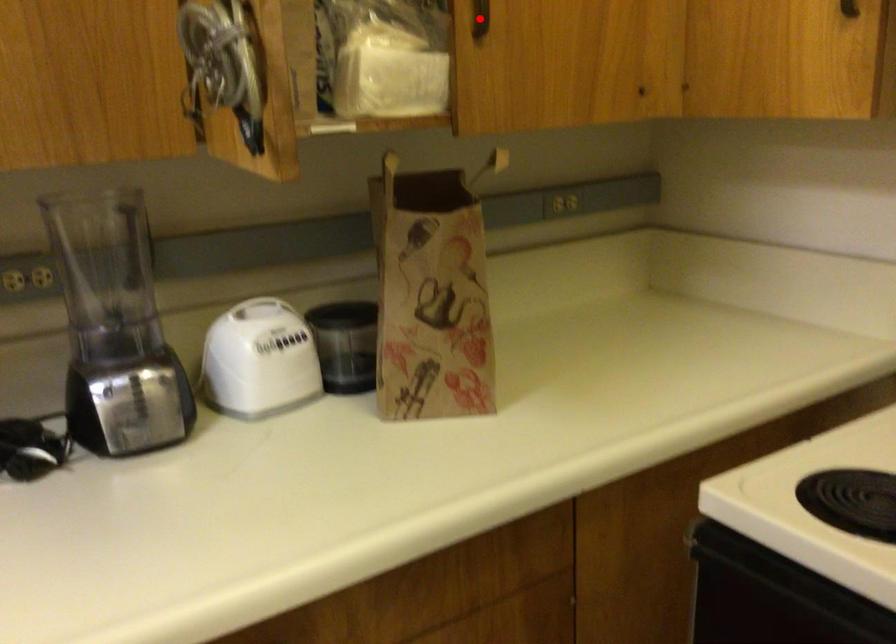
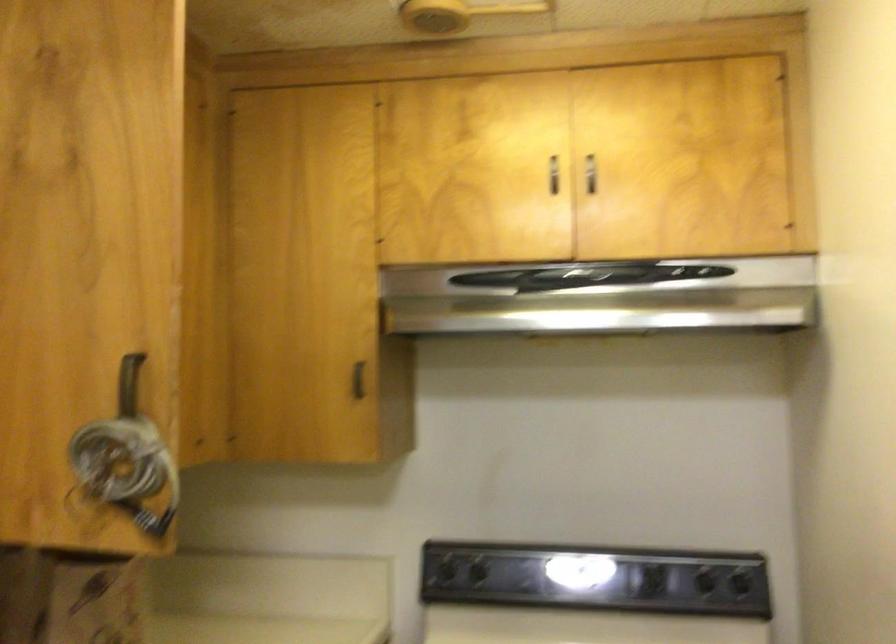
Question: I am providing you with two images of the same scene from different viewpoints. Image1 has a red point marked. In image2, the corresponding 3D location appears at what relative position? Reply with the corresponding letter.

Choices:
 (A) Closer
 (B) Farther

Answer: (A)